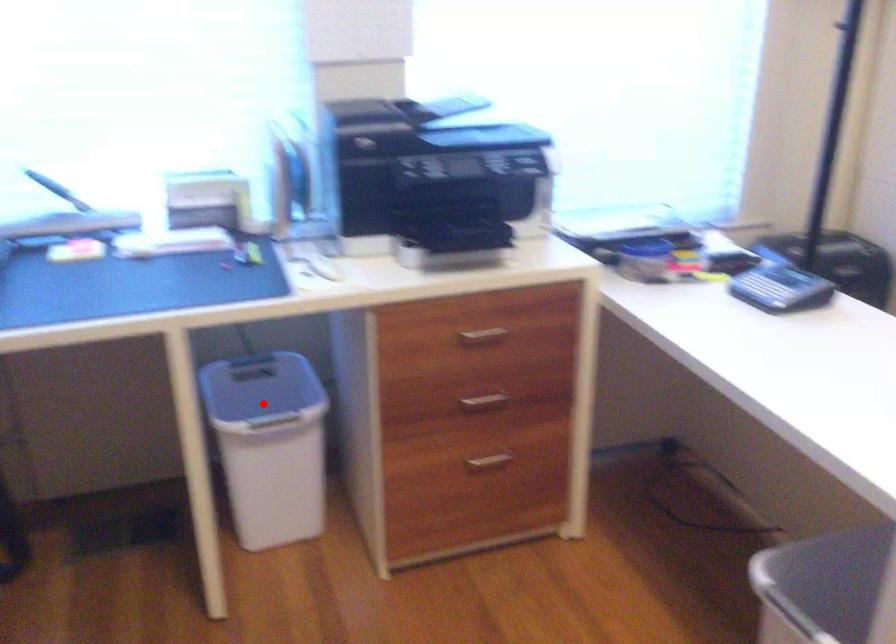
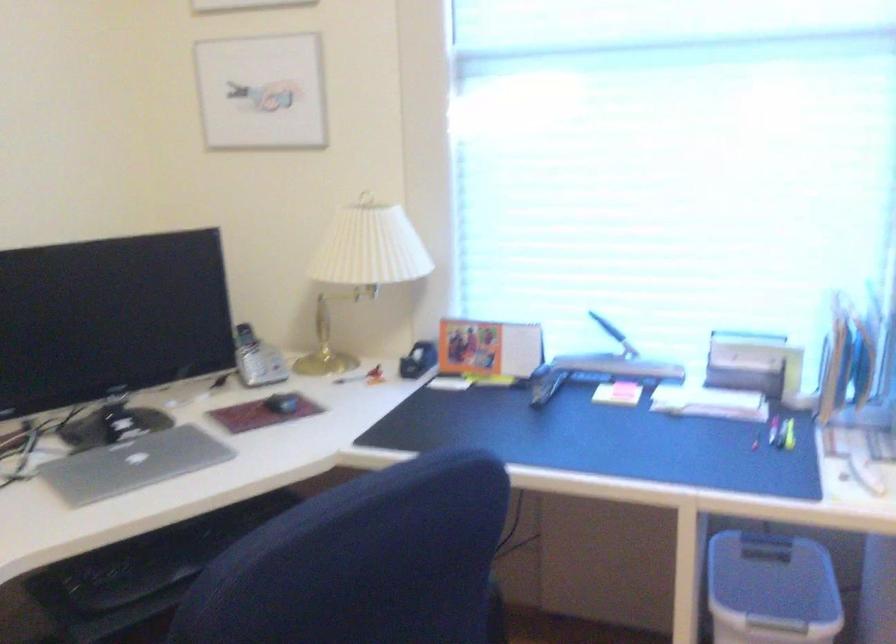
Find the pixel in the second image that matches the highlighted location in the first image.

(771, 589)